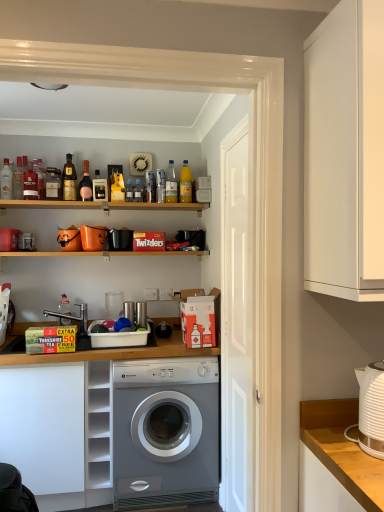
Question: Is yellow cardboard box at lower left looking in the opposite direction of white plastic dish rack at center, which is counted as the third appliance, starting from the back?

Choices:
 (A) yes
 (B) no

Answer: (B)

Question: Does yellow cardboard box at lower left appear on the left side of white plastic dish rack at center, which is counted as the first appliance, starting from the bottom?

Choices:
 (A) yes
 (B) no

Answer: (A)

Question: Is yellow cardboard box at lower left thinner than white plastic dish rack at center, acting as the second appliance starting from the left?

Choices:
 (A) yes
 (B) no

Answer: (B)

Question: Is yellow cardboard box at lower left oriented towards white plastic dish rack at center, the second appliance in the front-to-back sequence?

Choices:
 (A) yes
 (B) no

Answer: (B)

Question: Is yellow cardboard box at lower left not near white plastic dish rack at center, arranged as the 3th appliance when viewed from the right?

Choices:
 (A) yes
 (B) no

Answer: (B)

Question: Is point (74, 318) positioned closer to the camera than point (226, 221)?

Choices:
 (A) closer
 (B) farther

Answer: (B)

Question: Is white glossy sink at lower left inside or outside of white matte door at center?

Choices:
 (A) outside
 (B) inside

Answer: (A)

Question: Is white glossy sink at lower left taller or shorter than white matte door at center?

Choices:
 (A) short
 (B) tall

Answer: (A)

Question: Considering the relative positions of white glossy sink at lower left and white matte door at center in the image provided, is white glossy sink at lower left to the left or to the right of white matte door at center?

Choices:
 (A) right
 (B) left

Answer: (B)

Question: From a real-world perspective, is matte glass bottle at upper center, positioned as the sixth bottle in left-to-right order, above or below shiny gold bottle at upper left, placed as the 4th bottle when sorted from left to right?

Choices:
 (A) above
 (B) below

Answer: (B)

Question: Considering the positions of matte glass bottle at upper center, which is the 4th bottle from right to left, and shiny gold bottle at upper left, placed as the 4th bottle when sorted from left to right, in the image, is matte glass bottle at upper center, which is the 4th bottle from right to left, wider or thinner than shiny gold bottle at upper left, placed as the 4th bottle when sorted from left to right,?

Choices:
 (A) wide
 (B) thin

Answer: (A)

Question: Is matte glass bottle at upper center, which is the 4th bottle from right to left, taller or shorter than shiny gold bottle at upper left, placed as the 4th bottle when sorted from left to right?

Choices:
 (A) short
 (B) tall

Answer: (A)

Question: In the image, is matte glass bottle at upper center, which is the 4th bottle from right to left, positioned in front of or behind shiny gold bottle at upper left, placed as the 4th bottle when sorted from left to right?

Choices:
 (A) front
 (B) behind

Answer: (A)

Question: Considering the positions of white plastic dish rack at center, arranged as the 3th appliance when viewed from the right, and white plastic kettle at right, placed as the 4th appliance when sorted from back to front, in the image, is white plastic dish rack at center, arranged as the 3th appliance when viewed from the right, bigger or smaller than white plastic kettle at right, placed as the 4th appliance when sorted from back to front,?

Choices:
 (A) big
 (B) small

Answer: (A)

Question: From the image's perspective, is white plastic dish rack at center, which is counted as the first appliance, starting from the bottom, located above or below white plastic kettle at right, the second appliance positioned from the bottom?

Choices:
 (A) below
 (B) above

Answer: (A)